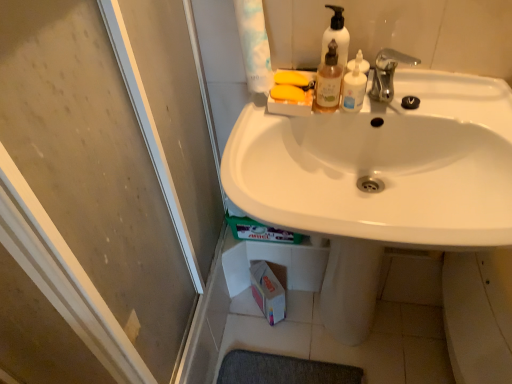
Question: Does point (327, 36) appear closer or farther from the camera than point (336, 91)?

Choices:
 (A) farther
 (B) closer

Answer: (A)

Question: Visually, is translucent plastic pump bottle at upper center positioned to the left or to the right of translucent plastic bottle at upper center, which appears as the second mouthwash when viewed from the right?

Choices:
 (A) left
 (B) right

Answer: (B)

Question: Estimate the real-world distances between objects in this image. Which object is closer to the white glossy sink at center?

Choices:
 (A) white plastic mouthwash at upper center, which is the 2th mouthwash from left to right
 (B) transparent glass screen door at left
 (C) white glossy toilet paper at upper center
 (D) silver metallic faucet at upper center
 (E) translucent plastic bottle at upper center, which is the first mouthwash in left-to-right order

Answer: (A)

Question: Estimate the real-world distances between objects in this image. Which object is farther from the white glossy sink at center?

Choices:
 (A) translucent plastic pump bottle at upper center
 (B) white glossy toilet paper at upper center
 (C) silver metallic faucet at upper center
 (D) translucent plastic bottle at upper center, which appears as the second mouthwash when viewed from the right
 (E) white plastic mouthwash at upper center, which is the 2th mouthwash from left to right

Answer: (B)